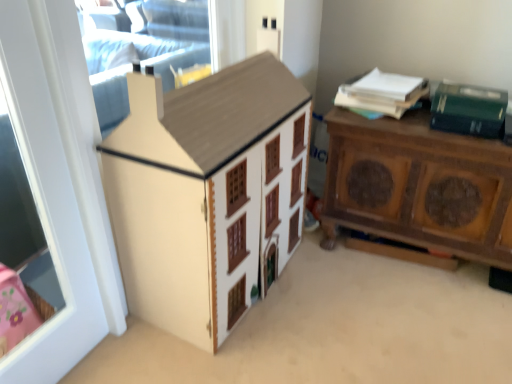
Question: In terms of size, does white glossy door at left appear bigger or smaller than matte wood cabinet at center?

Choices:
 (A) small
 (B) big

Answer: (A)

Question: In the image, is white glossy door at left positioned in front of or behind matte wood cabinet at center?

Choices:
 (A) behind
 (B) front

Answer: (B)

Question: Considering the real-world distances, which object is closest to the green matte box at upper right?

Choices:
 (A) brown wood nightstand at right
 (B) matte wood cabinet at center
 (C) white paper at upper right
 (D) white glossy door at left

Answer: (C)

Question: Estimate the real-world distances between objects in this image. Which object is farther from the matte wood cabinet at center?

Choices:
 (A) brown wood nightstand at right
 (B) white paper at upper right
 (C) white glossy door at left
 (D) green matte box at upper right

Answer: (D)